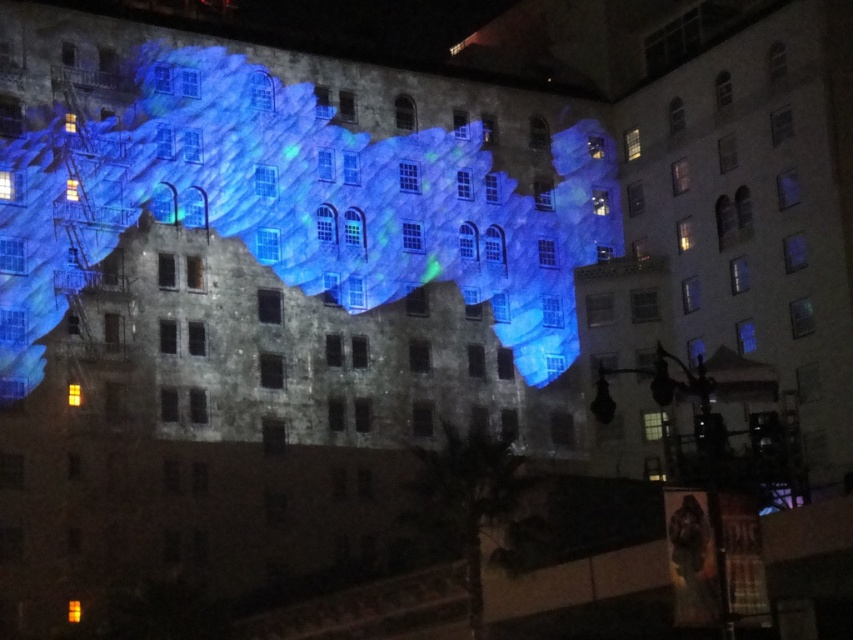
Which is above, yellow matte light at center or orange matte light at lower left?

Positioned higher is yellow matte light at center.

Can you confirm if yellow matte light at center is bigger than orange matte light at lower left?

No.

At what (x,y) coordinates should I click in order to perform the action: click on yellow matte light at center. Please return your answer as a coordinate pair (x, y). The image size is (853, 640). Looking at the image, I should click on (74, 394).

This screenshot has height=640, width=853. Find the location of `yellow matte light at center`. yellow matte light at center is located at coordinates (74, 394).